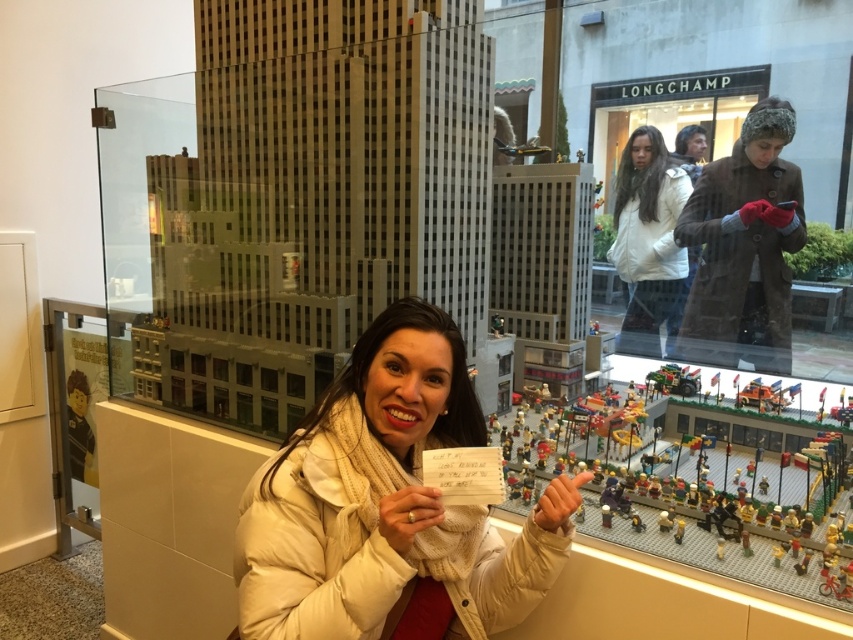
Does brown woolen hat at upper right appear on the left side of white matte jacket at upper center?

Incorrect, brown woolen hat at upper right is not on the left side of white matte jacket at upper center.

Can you confirm if brown woolen hat at upper right is positioned below white matte jacket at upper center?

Answer: Indeed, brown woolen hat at upper right is positioned under white matte jacket at upper center.

Does point (708, 244) come behind point (648, 275)?

No, (708, 244) is closer to viewer.

Find the location of a particular element. Image resolution: width=853 pixels, height=640 pixels. brown woolen hat at upper right is located at coordinates (744, 246).

Is the position of white puffy coat at center more distant than that of green plastic car at center?

No, it is not.

Who is lower down, white puffy coat at center or green plastic car at center?

white puffy coat at center is lower down.

Who is more distant from viewer, (399, 458) or (691, 394)?

The point (691, 394) is behind.

This screenshot has height=640, width=853. Find the location of `white puffy coat at center`. white puffy coat at center is located at coordinates (387, 506).

Measure the distance between brick-like lego set at center and green plastic car at center.

brick-like lego set at center and green plastic car at center are 14.10 inches apart from each other.

Which of these two, brick-like lego set at center or green plastic car at center, stands shorter?

green plastic car at center is shorter.

Which is in front, point (692, 481) or point (686, 394)?

Point (692, 481) is in front.

The image size is (853, 640). I want to click on brick-like lego set at center, so click(x=734, y=504).